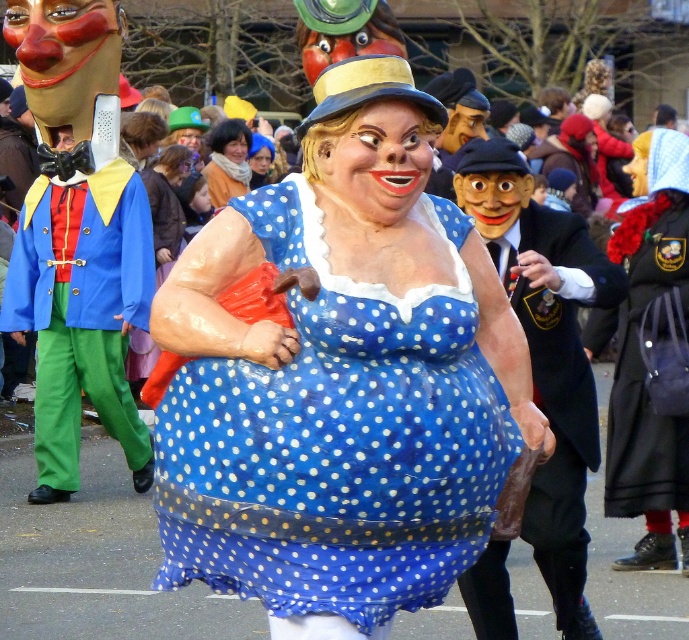
You are a photographer at the carnival trying to capture the blue polka dot dress at center and the matte blue suit at left. Which of the two is positioned closer to you?

The matte blue suit at left is closer to the viewer than the blue polka dot dress at center.

You are a photographer at the carnival. You want to capture a photo that includes both the matte black suit at center and the blue polka dot dress at center. Which object should you focus on first to ensure both are in frame?

The matte black suit at center is larger in size than the blue polka dot dress at center, so you should focus on the matte black suit at center first to ensure both are in frame.

You are a photographer at the carnival. You want to capture a photo that includes both the matte blue suit at left and the blue polka dot dress at center. Considering their sizes, which one should you frame first to ensure both fit in the shot?

The matte blue suit at left is wider than the blue polka dot dress at center, so you should frame the matte blue suit at left first to ensure both fit in the shot.